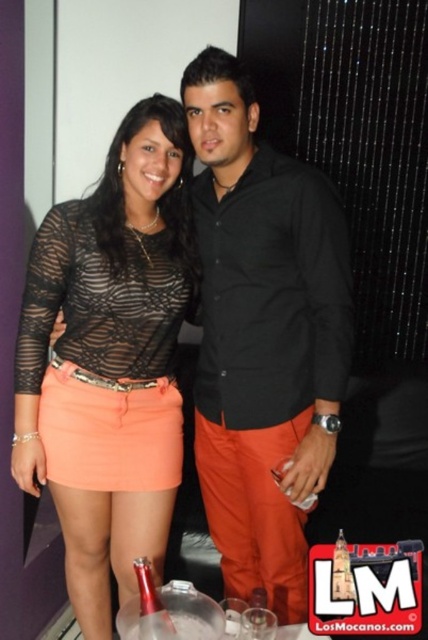
Question: Is matte black sheer top at center positioned in front of metallic silver bottle at center?

Choices:
 (A) no
 (B) yes

Answer: (A)

Question: Which of the following is the closest to the observer?

Choices:
 (A) metallic silver bottle at center
 (B) matte black sheer top at center

Answer: (A)

Question: Which point is farther to the camera?

Choices:
 (A) (148, 148)
 (B) (143, 577)
 (C) (204, 316)

Answer: (C)

Question: Can you confirm if matte black sheer top at center is positioned below metallic silver bottle at center?

Choices:
 (A) yes
 (B) no

Answer: (B)

Question: Observing the image, what is the correct spatial positioning of black matte shirt at center in reference to metallic silver bottle at center?

Choices:
 (A) left
 (B) right

Answer: (B)

Question: Considering the real-world distances, which object is farthest from the black matte shirt at center?

Choices:
 (A) matte black sheer top at center
 (B) metallic silver bottle at center

Answer: (B)